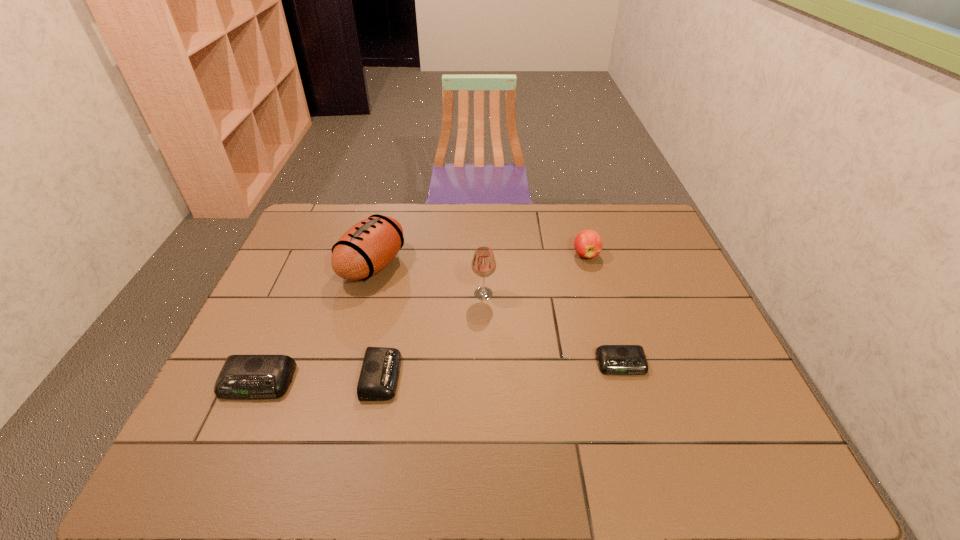
If equal spacing is the goal by inserting an additional alarm_clock among them, please point out a vacant space for this new alarm_clock. Please provide its 2D coordinates. Your answer should be formatted as a tuple, i.e. [(x, y)], where the tuple contains the x and y coordinates of a point satisfying the conditions above.

[(503, 370)]